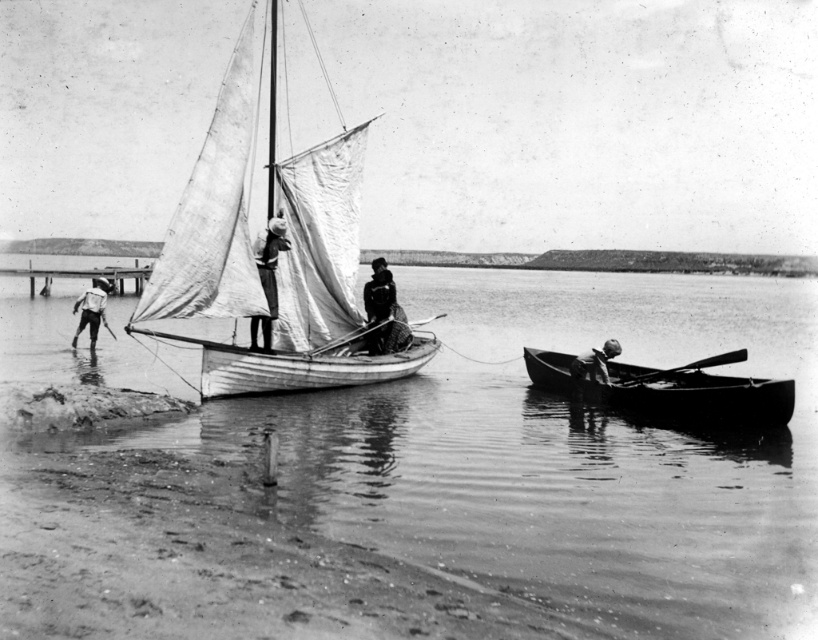
You are a photographer trying to capture a clear image of both the smooth dark wood canoe at lower right and the smooth wooden paddle at lower right. Based on their positions, which object should you focus on first to ensure both are in frame?

The smooth dark wood canoe at lower right is in front of the smooth wooden paddle at lower right, so you should focus on the smooth wooden paddle at lower right first to ensure both are in frame.

In the coastal scene, there is a dark fabric couple at center and a light brown wooden stick at lower left. From the perspective of an observer standing on the shore, which object is positioned higher in the image?

The dark fabric couple at center is positioned higher than the light brown wooden stick at lower left in the image.

You are a photographer who wants to capture both the light brown wooden stick at lower left and the smooth wooden paddle at lower right in the same frame. Which object should you focus on first if you want to include both in your shot without moving the camera?

You should focus on the light brown wooden stick at lower left first because it is larger than the smooth wooden paddle at lower right, making it easier to center in the frame while still capturing the smaller paddle in the background.